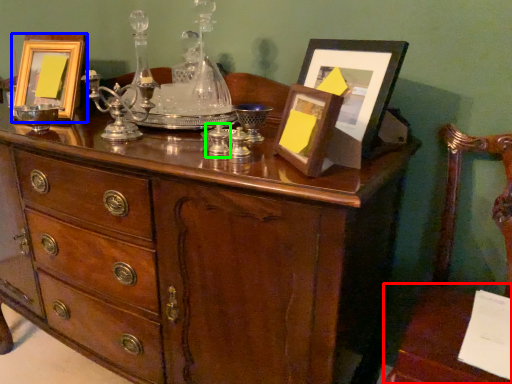
Question: Which object is positioned farthest from table (highlighted by a red box)? Select from picture frame (highlighted by a blue box) and candle holder (highlighted by a green box).

Choices:
 (A) picture frame
 (B) candle holder

Answer: (A)